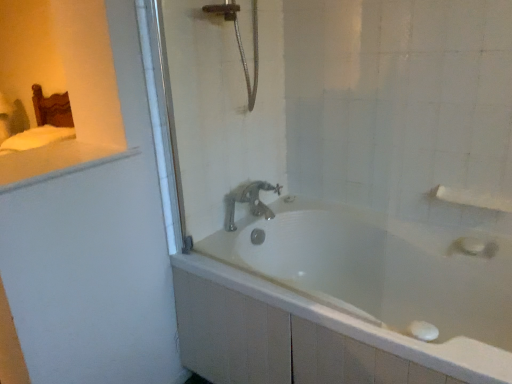
Question: Is white matte towel bar at upper right touching white glossy counter top at upper left?

Choices:
 (A) no
 (B) yes

Answer: (A)

Question: Are white matte towel bar at upper right and white glossy counter top at upper left far apart?

Choices:
 (A) yes
 (B) no

Answer: (A)

Question: Can you confirm if white matte towel bar at upper right is positioned to the left of white glossy counter top at upper left?

Choices:
 (A) no
 (B) yes

Answer: (A)

Question: From a real-world perspective, is white matte towel bar at upper right below white glossy counter top at upper left?

Choices:
 (A) yes
 (B) no

Answer: (A)

Question: Is white matte towel bar at upper right facing away from white glossy counter top at upper left?

Choices:
 (A) no
 (B) yes

Answer: (A)

Question: In terms of width, does white glossy counter top at upper left look wider or thinner when compared to polished chrome faucet at center?

Choices:
 (A) wide
 (B) thin

Answer: (A)

Question: Considering the positions of point (88, 153) and point (258, 205), is point (88, 153) closer or farther from the camera than point (258, 205)?

Choices:
 (A) farther
 (B) closer

Answer: (B)

Question: Choose the correct answer: Is white glossy counter top at upper left inside polished chrome faucet at center or outside it?

Choices:
 (A) outside
 (B) inside

Answer: (A)

Question: From a real-world perspective, relative to polished chrome faucet at center, is white glossy counter top at upper left vertically above or below?

Choices:
 (A) below
 (B) above

Answer: (B)

Question: In terms of size, does clear glass shower door at center appear bigger or smaller than white matte towel bar at upper right?

Choices:
 (A) small
 (B) big

Answer: (B)

Question: In the image, is clear glass shower door at center on the left side or the right side of white matte towel bar at upper right?

Choices:
 (A) right
 (B) left

Answer: (B)

Question: From the image's perspective, is clear glass shower door at center located above or below white matte towel bar at upper right?

Choices:
 (A) below
 (B) above

Answer: (B)

Question: Is clear glass shower door at center spatially inside white matte towel bar at upper right, or outside of it?

Choices:
 (A) inside
 (B) outside

Answer: (B)

Question: Visually, is white glossy bathtub at center positioned to the left or to the right of polished chrome faucet at center?

Choices:
 (A) right
 (B) left

Answer: (A)

Question: Considering the positions of point (227, 236) and point (279, 185), is point (227, 236) closer or farther from the camera than point (279, 185)?

Choices:
 (A) closer
 (B) farther

Answer: (A)